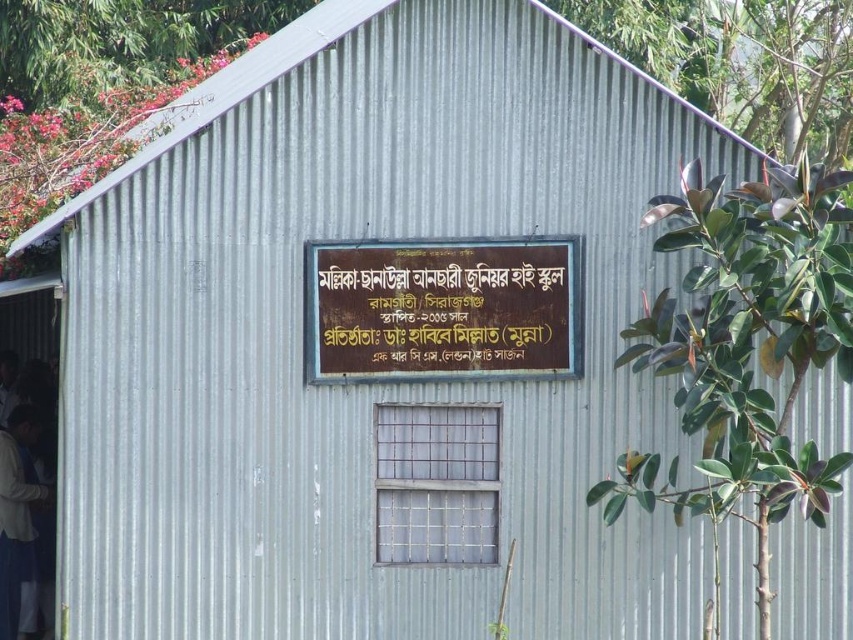
Is gold polished wood sign at center wider than white fabric shirt at lower left?

Indeed, gold polished wood sign at center has a greater width compared to white fabric shirt at lower left.

Is gold polished wood sign at center shorter than white fabric shirt at lower left?

Yes, gold polished wood sign at center is shorter than white fabric shirt at lower left.

Find the location of `gold polished wood sign at center`. gold polished wood sign at center is located at coordinates (442, 308).

Locate an element on the screen. gold polished wood sign at center is located at coordinates (442, 308).